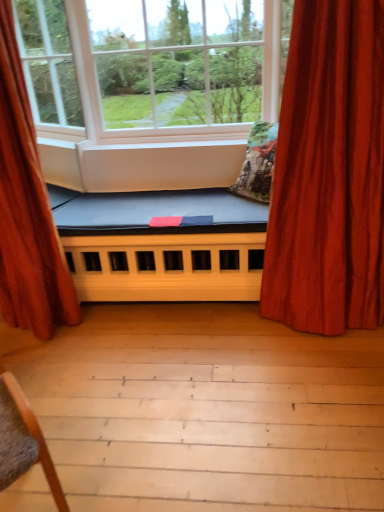
Question: From a real-world perspective, is velvet red curtain at left, which is the 2th curtain in right-to-left order, physically below blue fabric futon at center?

Choices:
 (A) no
 (B) yes

Answer: (A)

Question: From the image's perspective, would you say velvet red curtain at left, which is the 2th curtain in right-to-left order, is shown under blue fabric futon at center?

Choices:
 (A) no
 (B) yes

Answer: (A)

Question: Is velvet red curtain at left, the 1th curtain in the left-to-right sequence, aimed at blue fabric futon at center?

Choices:
 (A) no
 (B) yes

Answer: (A)

Question: Does velvet red curtain at left, which is the 2th curtain in right-to-left order, have a smaller size compared to blue fabric futon at center?

Choices:
 (A) yes
 (B) no

Answer: (A)

Question: Does velvet red curtain at left, which is the 2th curtain in right-to-left order, have a greater height compared to blue fabric futon at center?

Choices:
 (A) yes
 (B) no

Answer: (A)

Question: Is point (59, 266) positioned closer to the camera than point (289, 209)?

Choices:
 (A) closer
 (B) farther

Answer: (B)

Question: Is velvet red curtain at left, the 1th curtain in the left-to-right sequence, taller or shorter than velvet red curtain at right, the 1th curtain when ordered from right to left?

Choices:
 (A) short
 (B) tall

Answer: (B)

Question: From a real-world perspective, is velvet red curtain at left, the 1th curtain in the left-to-right sequence, positioned above or below velvet red curtain at right, the 1th curtain when ordered from right to left?

Choices:
 (A) above
 (B) below

Answer: (A)

Question: Looking at their shapes, would you say velvet red curtain at left, which is the 2th curtain in right-to-left order, is wider or thinner than velvet red curtain at right, the 1th curtain when ordered from right to left?

Choices:
 (A) thin
 (B) wide

Answer: (B)

Question: Is point (99, 194) positioned closer to the camera than point (231, 118)?

Choices:
 (A) farther
 (B) closer

Answer: (B)

Question: Considering the positions of blue fabric futon at center and white matte window at center, which ranks as the 2th window in left-to-right order, in the image, is blue fabric futon at center taller or shorter than white matte window at center, which ranks as the 2th window in left-to-right order,?

Choices:
 (A) short
 (B) tall

Answer: (A)

Question: From a real-world perspective, is blue fabric futon at center above or below white matte window at center, which ranks as the 2th window in left-to-right order?

Choices:
 (A) above
 (B) below

Answer: (B)

Question: Considering the positions of blue fabric futon at center and white matte window at center, positioned as the first window in right-to-left order, in the image, is blue fabric futon at center bigger or smaller than white matte window at center, positioned as the first window in right-to-left order,?

Choices:
 (A) big
 (B) small

Answer: (B)

Question: Is velvet red curtain at right, arranged as the 2th curtain when viewed from the left, to the left or to the right of velvet red curtain at left, which is the 2th curtain in right-to-left order, in the image?

Choices:
 (A) right
 (B) left

Answer: (A)

Question: Considering their positions, is velvet red curtain at right, arranged as the 2th curtain when viewed from the left, located in front of or behind velvet red curtain at left, which is the 2th curtain in right-to-left order?

Choices:
 (A) behind
 (B) front

Answer: (B)